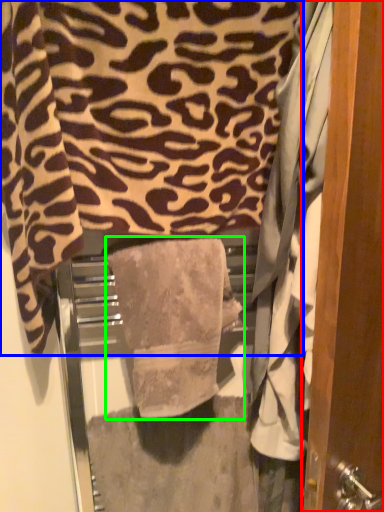
Question: Considering the real-world distances, which object is closest to door (highlighted by a red box)? towel (highlighted by a blue box) or towel (highlighted by a green box).

Choices:
 (A) towel
 (B) towel

Answer: (B)